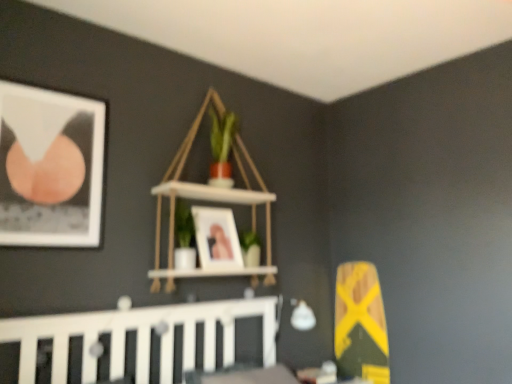
Question: Is matte black picture frame at upper left, arranged as the 1th picture frame when viewed from the front, in front of or behind white wood shelf at upper center in the image?

Choices:
 (A) front
 (B) behind

Answer: (A)

Question: From a real-world perspective, is matte black picture frame at upper left, which ranks as the second picture frame in right-to-left order, physically located above or below white wood shelf at upper center?

Choices:
 (A) below
 (B) above

Answer: (A)

Question: Considering the real-world distances, which object is farthest from the matte wooden picture frame at center, which is the second picture frame in front-to-back order?

Choices:
 (A) matte black picture frame at upper left, the second picture frame viewed from the back
 (B) white wood shelf at upper center
 (C) white wooden crib at lower left

Answer: (A)

Question: Which of these objects is positioned farthest from the white wooden crib at lower left?

Choices:
 (A) matte black picture frame at upper left, which ranks as the second picture frame in right-to-left order
 (B) white wood shelf at upper center
 (C) matte wooden picture frame at center, which is the second picture frame in front-to-back order

Answer: (A)